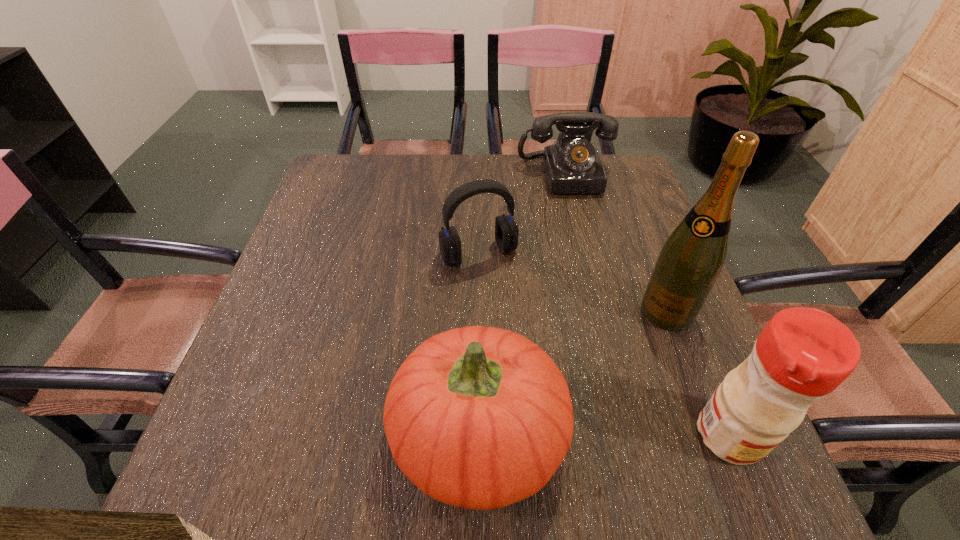
Locate an element on the screen. Image resolution: width=960 pixels, height=540 pixels. free spot that satisfies the following two spatial constraints: 1. on the front side of the tallest object; 2. on the right side of the headset is located at coordinates (479, 311).

Locate an element on the screen. The image size is (960, 540). vacant region that satisfies the following two spatial constraints: 1. on the front side of the tallest object; 2. on the right side of the condiment is located at coordinates (714, 435).

The height and width of the screenshot is (540, 960). In order to click on free space that satisfies the following two spatial constraints: 1. on the back side of the fourth nearest object; 2. on the left side of the shortest object in this screenshot , I will do `click(479, 174)`.

Where is `free region that satisfies the following two spatial constraints: 1. on the back side of the headset; 2. on the right side of the telephone`? free region that satisfies the following two spatial constraints: 1. on the back side of the headset; 2. on the right side of the telephone is located at coordinates (479, 174).

At what (x,y) coordinates should I click in order to perform the action: click on vacant area in the image that satisfies the following two spatial constraints: 1. on the front side of the farthest object; 2. on the right side of the fourth shortest object. Please return your answer as a coordinate pair (x, y). Looking at the image, I should click on (628, 435).